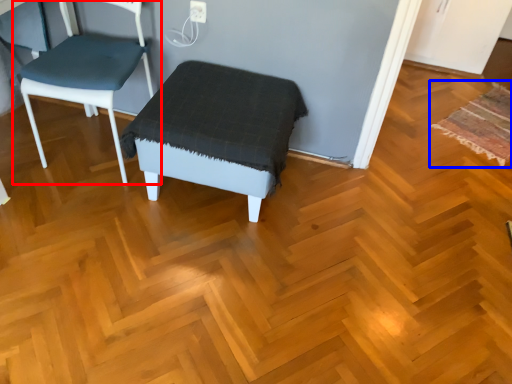
Question: Which object is closer to the camera taking this photo, chair (highlighted by a red box) or mat (highlighted by a blue box)?

Choices:
 (A) chair
 (B) mat

Answer: (A)